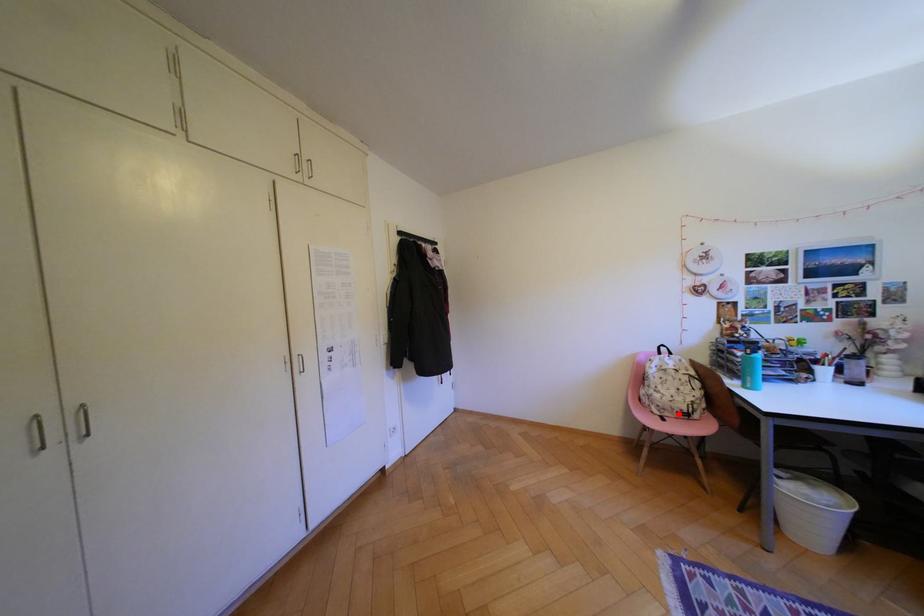
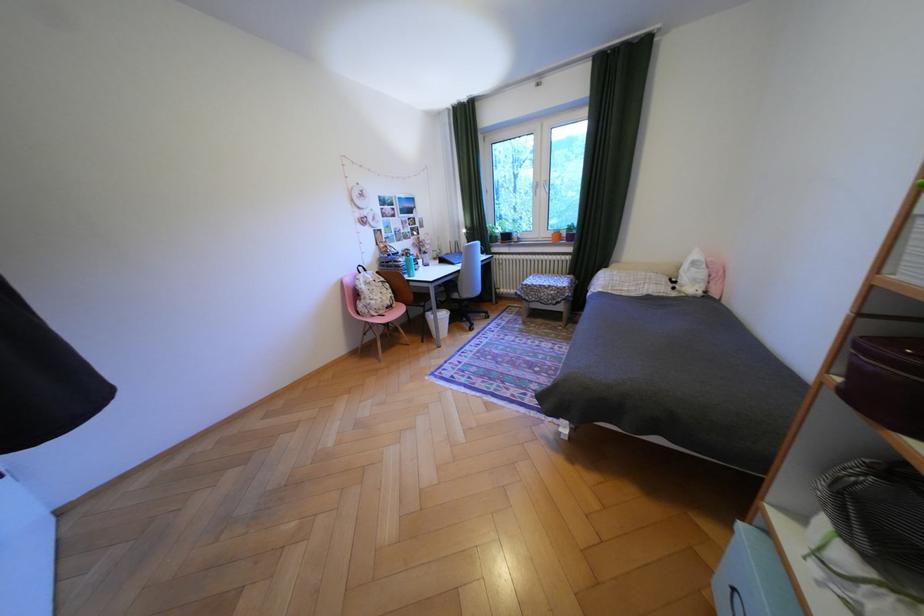
Locate, in the second image, the point that corresponds to the highlighted location in the first image.

(393, 312)